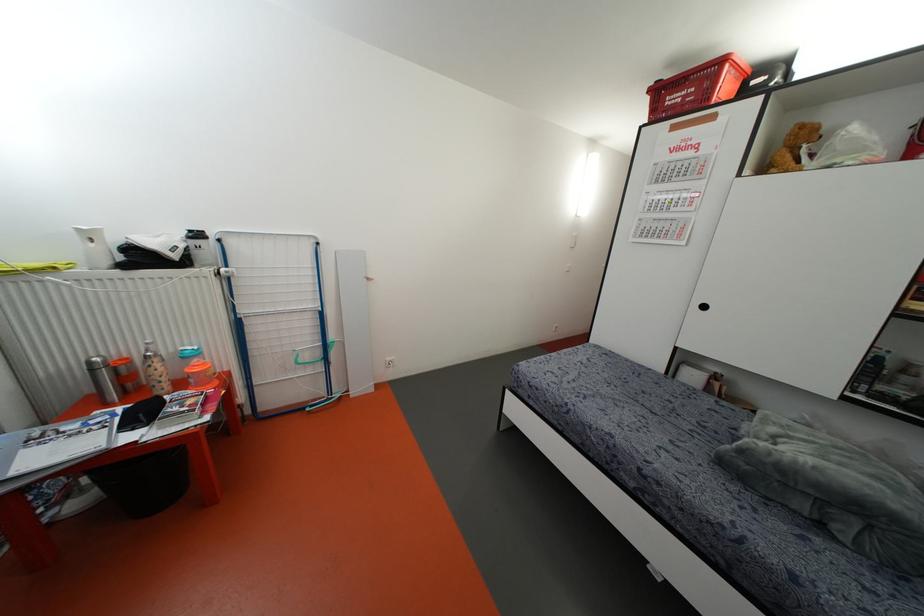
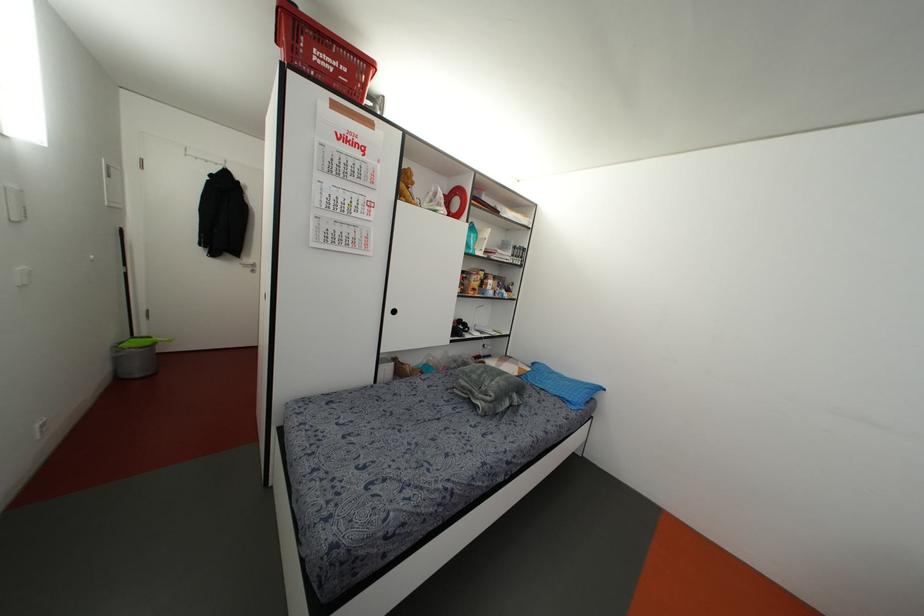
Locate, in the second image, the point that corresponds to pixel 703 307 in the first image.

(394, 310)